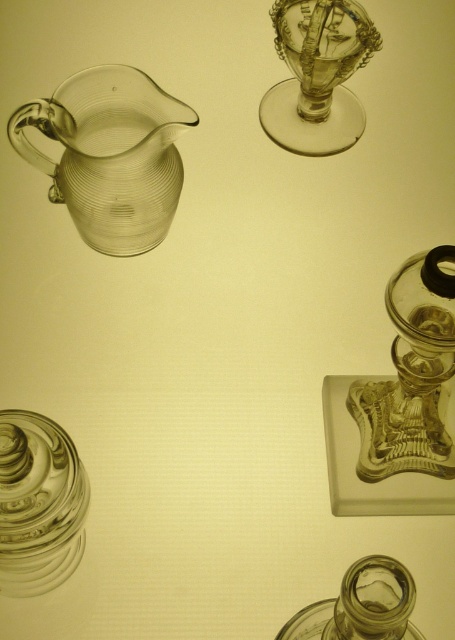
Does clear glass jar at lower left appear on the left side of transparent glass jar at bottom?

Indeed, clear glass jar at lower left is positioned on the left side of transparent glass jar at bottom.

Is clear glass jar at lower left positioned behind transparent glass jar at bottom?

Yes.

Does point (81, 504) lie behind point (367, 620)?

Yes, point (81, 504) is farther from viewer.

At what (x,y) coordinates should I click in order to perform the action: click on clear glass jar at lower left. Please return your answer as a coordinate pair (x, y). Image resolution: width=455 pixels, height=640 pixels. Looking at the image, I should click on [x=39, y=502].

Measure the distance between transparent glass jug at upper left and camera.

The distance of transparent glass jug at upper left from camera is 39.16 centimeters.

The height and width of the screenshot is (640, 455). What do you see at coordinates (110, 154) in the screenshot?
I see `transparent glass jug at upper left` at bounding box center [110, 154].

Where is `transparent glass jug at upper left`? transparent glass jug at upper left is located at coordinates (110, 154).

Which is more to the left, transparent glass jug at upper left or transparent glass wine glass at upper center?

From the viewer's perspective, transparent glass jug at upper left appears more on the left side.

At what (x,y) coordinates should I click in order to perform the action: click on transparent glass jug at upper left. Please return your answer as a coordinate pair (x, y). Looking at the image, I should click on (110, 154).

At what (x,y) coordinates should I click in order to perform the action: click on transparent glass jug at upper left. Please return your answer as a coordinate pair (x, y). Image resolution: width=455 pixels, height=640 pixels. Looking at the image, I should click on (110, 154).